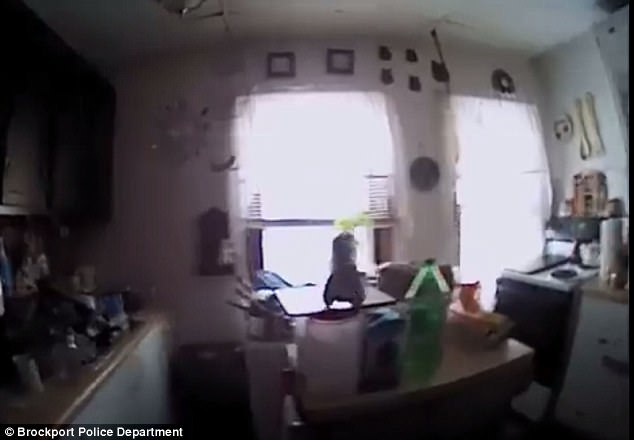
Locate an element on the screen. Image resolution: width=634 pixels, height=440 pixels. oven is located at coordinates (541, 292).